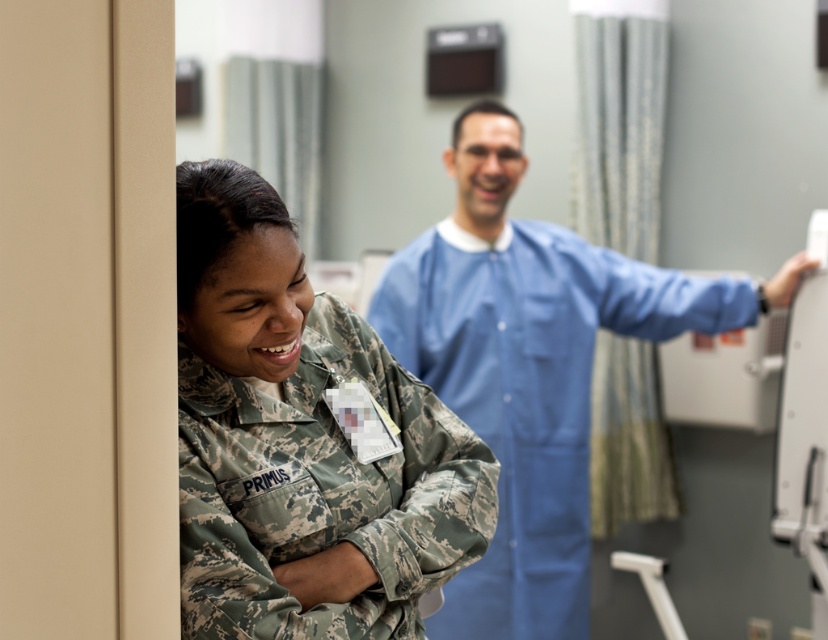
Which is more to the right, camouflage uniform at left or blue smooth lab coat at center?

blue smooth lab coat at center is more to the right.

Is camouflage uniform at left in front of blue smooth lab coat at center?

Yes, it is in front of blue smooth lab coat at center.

Is point (343, 428) positioned before point (493, 557)?

Yes, it is.

In order to click on camouflage uniform at left in this screenshot , I will do `click(301, 440)`.